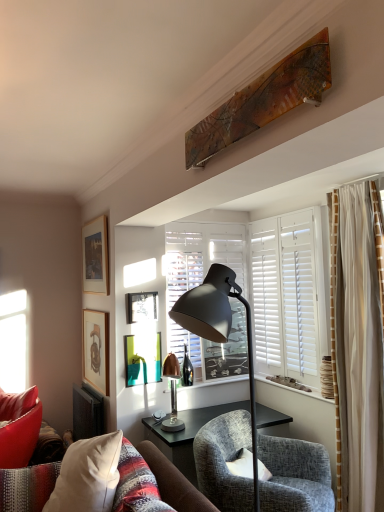
You are a GUI agent. You are given a task and a screenshot of the screen. Output one action in this format:
    pyautogui.click(x=<x>, y=<y>)
    Task: Click on the free space above white matte window at center (from a real-world perspective)
    
    Given the screenshot: What is the action you would take?
    pyautogui.click(x=215, y=215)